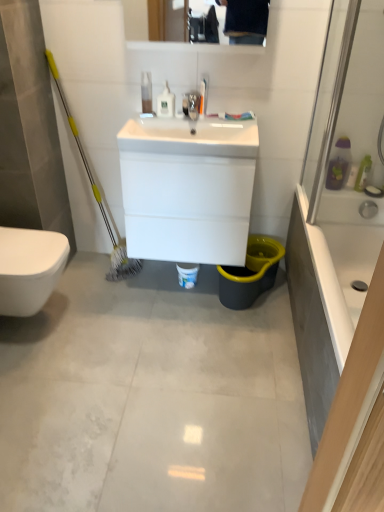
Where is `free region under white glossy bidet at lower left (from a real-world perspective)`? Image resolution: width=384 pixels, height=512 pixels. free region under white glossy bidet at lower left (from a real-world perspective) is located at coordinates (39, 323).